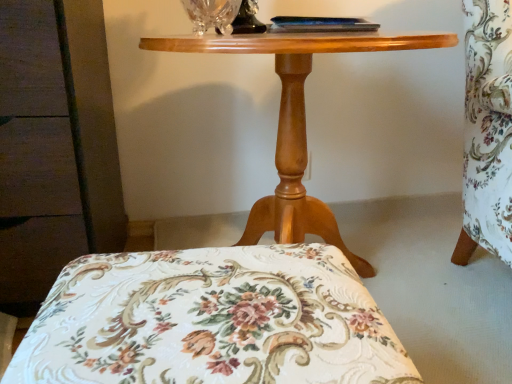
Question: Can you confirm if transparent crystal vase at upper center is wider than clear glass table lamp at upper center?

Choices:
 (A) yes
 (B) no

Answer: (A)

Question: From the image's perspective, would you say transparent crystal vase at upper center is positioned over clear glass table lamp at upper center?

Choices:
 (A) no
 (B) yes

Answer: (A)

Question: Does transparent crystal vase at upper center come behind clear glass table lamp at upper center?

Choices:
 (A) yes
 (B) no

Answer: (B)

Question: Is transparent crystal vase at upper center next to clear glass table lamp at upper center and touching it?

Choices:
 (A) no
 (B) yes

Answer: (B)

Question: Is transparent crystal vase at upper center turned away from clear glass table lamp at upper center?

Choices:
 (A) yes
 (B) no

Answer: (B)

Question: From a real-world perspective, is transparent crystal vase at upper center physically below clear glass table lamp at upper center?

Choices:
 (A) yes
 (B) no

Answer: (A)

Question: Is there a large distance between floral fabric cushion at center and wooden table at center?

Choices:
 (A) yes
 (B) no

Answer: (B)

Question: Does floral fabric cushion at center have a greater width compared to wooden table at center?

Choices:
 (A) yes
 (B) no

Answer: (B)

Question: Can you confirm if floral fabric cushion at center is shorter than wooden table at center?

Choices:
 (A) no
 (B) yes

Answer: (B)

Question: Is floral fabric cushion at center positioned with its back to wooden table at center?

Choices:
 (A) yes
 (B) no

Answer: (B)

Question: Does floral fabric cushion at center have a larger size compared to wooden table at center?

Choices:
 (A) no
 (B) yes

Answer: (A)

Question: Considering the relative positions of floral fabric cushion at center and wooden table at center in the image provided, is floral fabric cushion at center to the left of wooden table at center from the viewer's perspective?

Choices:
 (A) no
 (B) yes

Answer: (B)

Question: Is transparent crystal vase at upper center completely or partially inside wooden table at center?

Choices:
 (A) yes
 (B) no

Answer: (B)